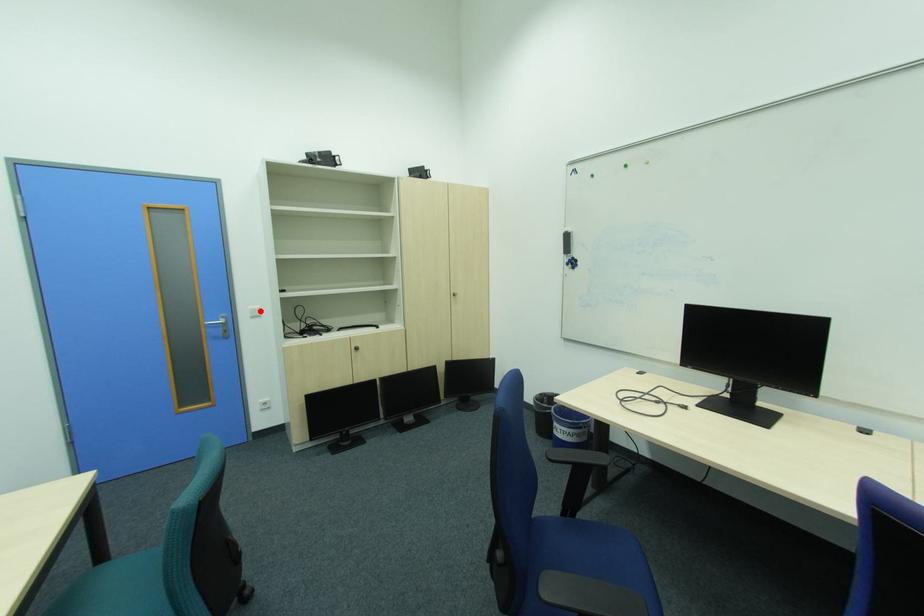
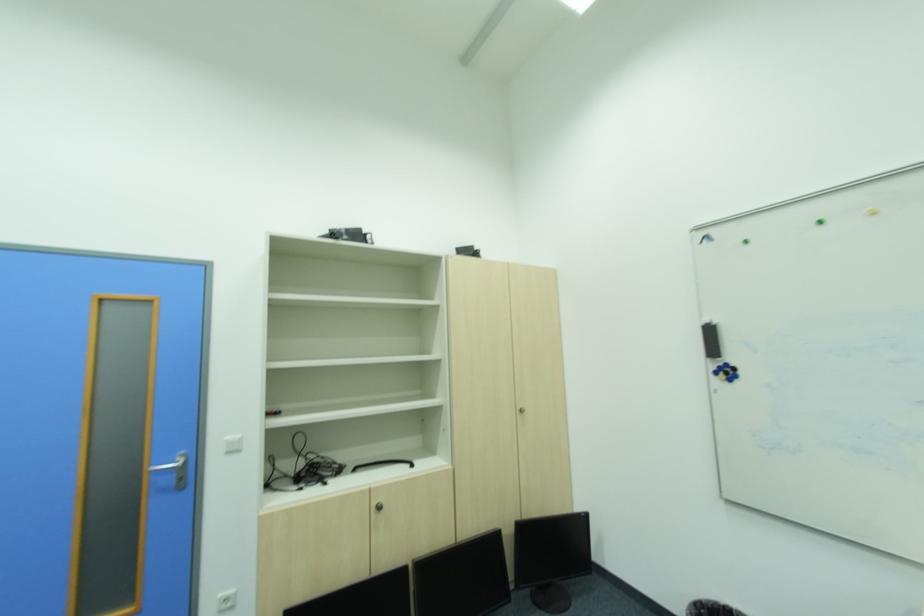
In the second image, find the point that corresponds to the highlighted location in the first image.

(237, 443)